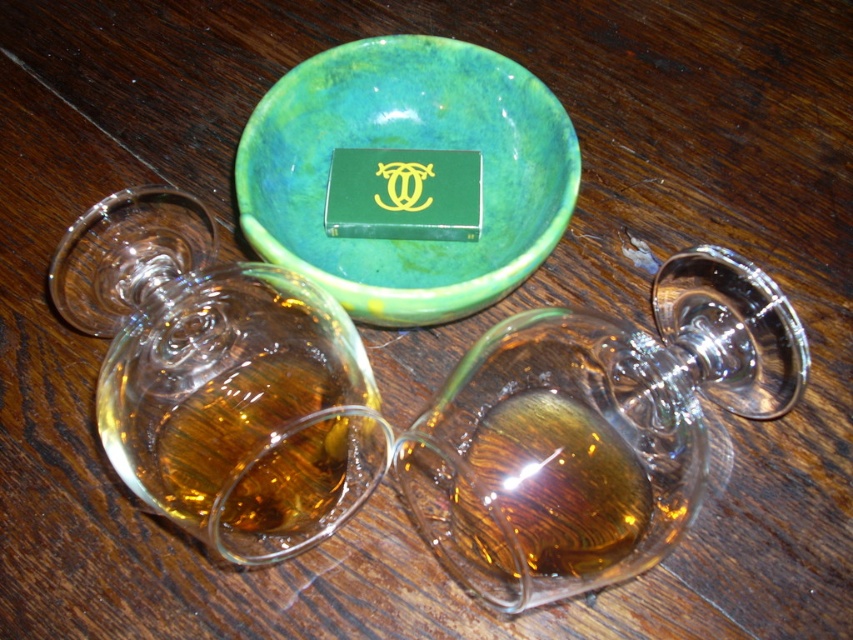
You are standing in front of the wooden surface with the three glasses and green bowl. There are two points marked on the image. Which of the two points, point 1 at coordinates (682,403) or point 2 at (540,104), is closer to you?

Point 1 at coordinates (682,403) is closer to the viewer than point 2 at (540,104).

You are arranging a dinner table and need to place a decorative item between the transparent glass wine glass at center and the green marbled bowl at center. Based on their current positions, where should you place it to ensure it is between them?

The transparent glass wine glass at center is positioned on the right side of the green marbled bowl at center. To place a decorative item between them, position it to the left of the transparent glass wine glass at center and to the right of the green marbled bowl at center.

You are setting up a table for a dinner party and need to place the transparent glass wine glass at center and the green marbled bowl at center. Which object should you place first to ensure proper spacing?

You should place the green marbled bowl at center first because it is larger than the transparent glass wine glass at center, allowing you to position the smaller glass around it appropriately.